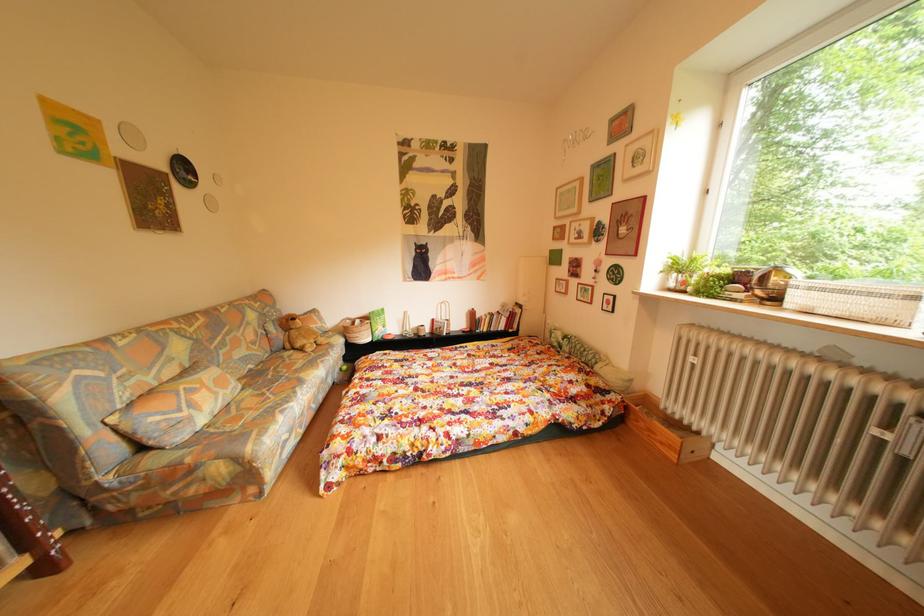
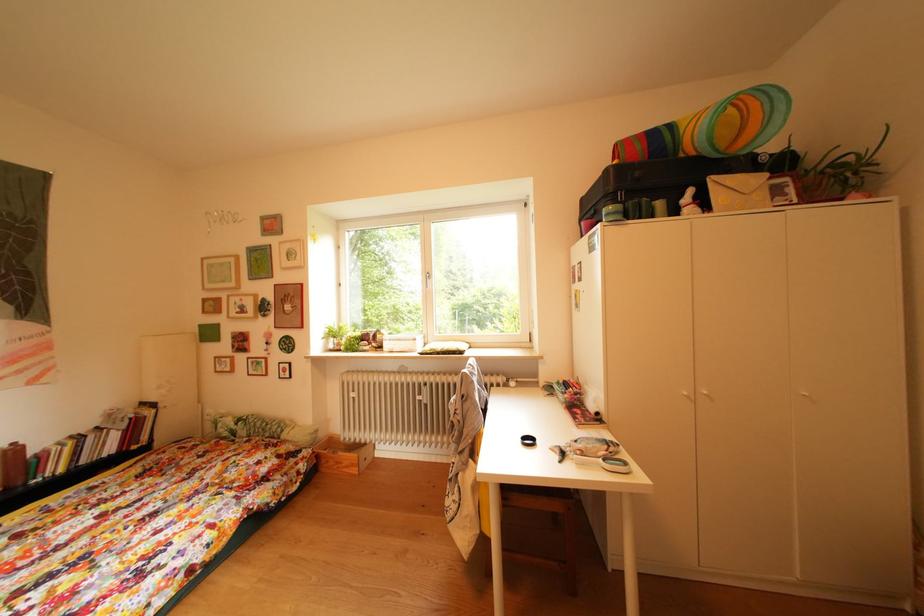
Question: The camera is either moving clockwise (left) or counter-clockwise (right) around the object. The first image is from the beginning of the video and the second image is from the end. Is the camera moving left or right when shooting the video?

Choices:
 (A) Left
 (B) Right

Answer: (A)